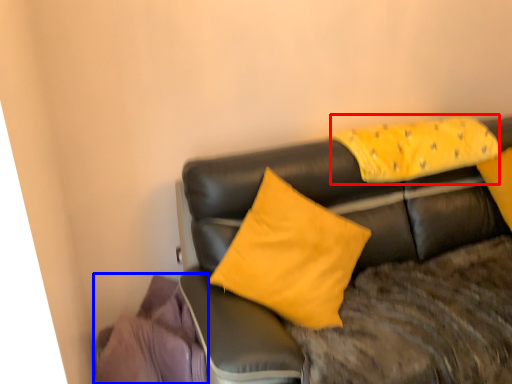
Question: Which object is further to the camera taking this photo, pillow (highlighted by a red box) or material (highlighted by a blue box)?

Choices:
 (A) pillow
 (B) material

Answer: (A)